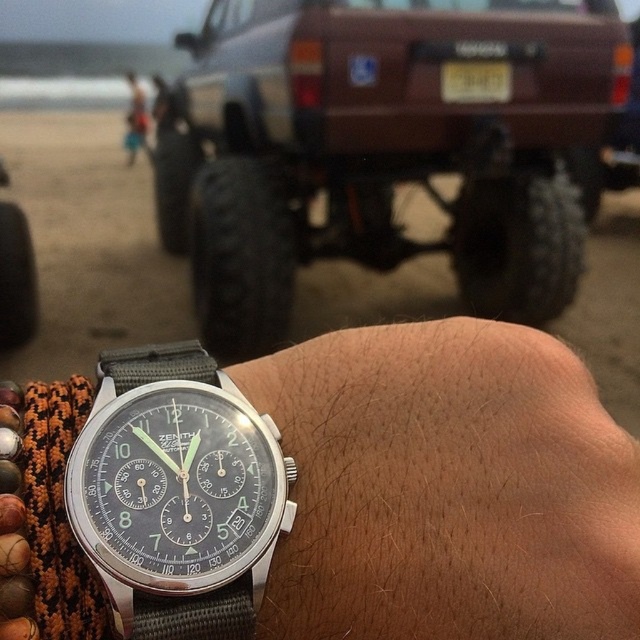
Between metallic watch at center and yellow matte license plate at center, which one is positioned lower?

metallic watch at center

Is metallic watch at center smaller than yellow matte license plate at center?

Incorrect, metallic watch at center is not smaller in size than yellow matte license plate at center.

Who is more distant from viewer, (x=400, y=541) or (x=492, y=100)?

The point (x=492, y=100) is more distant.

Where is `metallic watch at center`? metallic watch at center is located at coordinates (456, 483).

Is brown matte jeep at center taller than yellow matte license plate at center?

Yes.

Is point (540, 282) less distant than point (476, 80)?

No, it is not.

You are a GUI agent. You are given a task and a screenshot of the screen. Output one action in this format:
    pyautogui.click(x=<x>, y=<y>)
    Task: Click on the brown matte jeep at center
    
    Given the screenshot: What is the action you would take?
    pyautogui.click(x=380, y=147)

Does silver metallic watch at center appear on the right side of yellow matte license plate at center?

No, silver metallic watch at center is not to the right of yellow matte license plate at center.

Does silver metallic watch at center have a smaller size compared to yellow matte license plate at center?

Actually, silver metallic watch at center might be larger than yellow matte license plate at center.

Where is `silver metallic watch at center`? This screenshot has width=640, height=640. silver metallic watch at center is located at coordinates (177, 493).